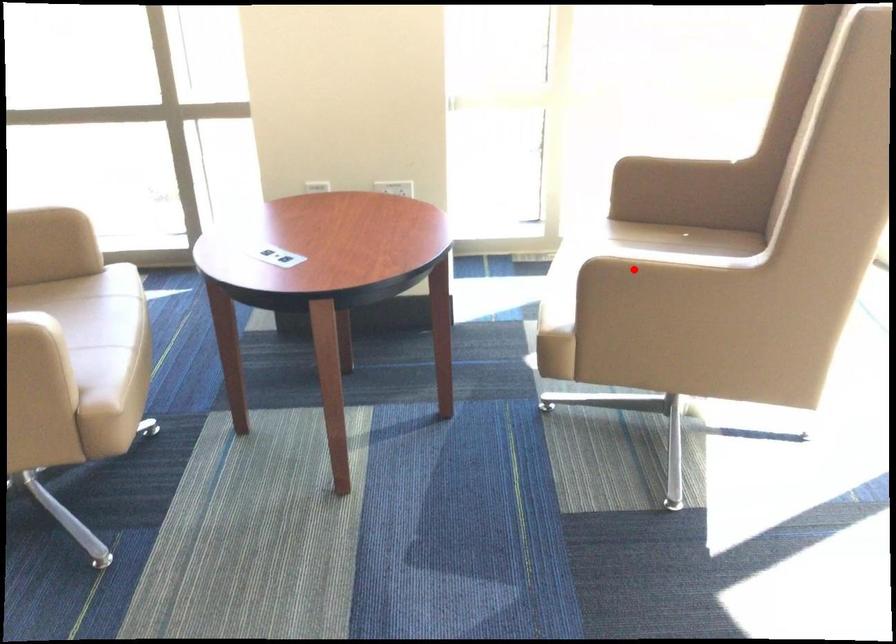
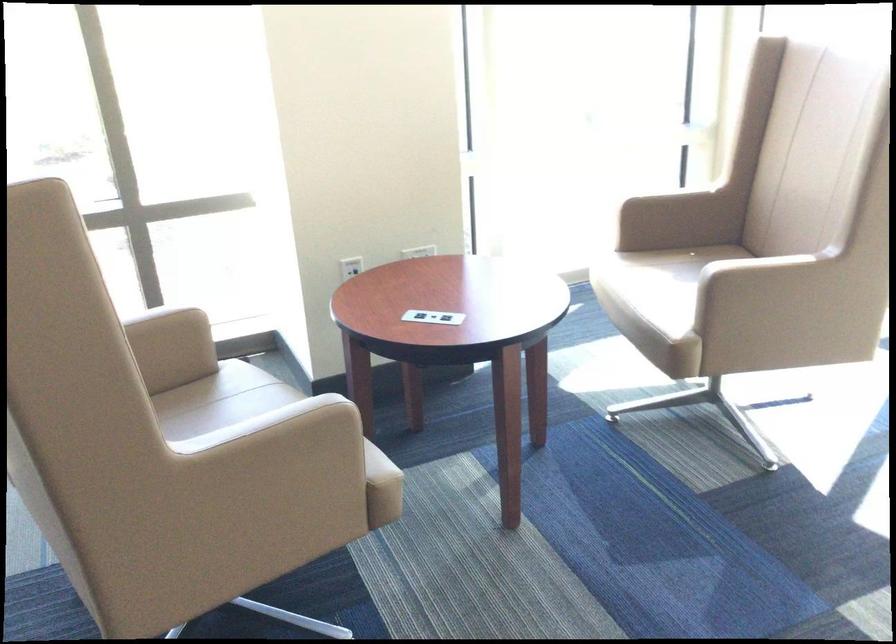
Question: I am providing you with two images of the same scene from different viewpoints. A red point is shown in image1. For the corresponding object point in image2, is it positioned nearer or farther from the camera?

Choices:
 (A) Nearer
 (B) Farther

Answer: (B)